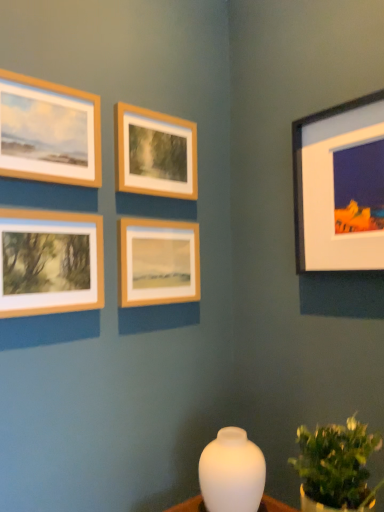
The height and width of the screenshot is (512, 384). What do you see at coordinates (50, 262) in the screenshot?
I see `matte wooden frame at lower left, the 4th picture frame in the right-to-left sequence` at bounding box center [50, 262].

Image resolution: width=384 pixels, height=512 pixels. What do you see at coordinates (154, 153) in the screenshot?
I see `wooden frame at upper center, which is counted as the 3th picture frame, starting from the right` at bounding box center [154, 153].

The width and height of the screenshot is (384, 512). In order to click on white glossy vase at center in this screenshot , I will do `click(232, 473)`.

What do you see at coordinates (337, 464) in the screenshot? The height and width of the screenshot is (512, 384). I see `green leafy plant at lower right` at bounding box center [337, 464].

At what (x,y) coordinates should I click in order to perform the action: click on matte wooden frame at lower left, the 4th picture frame in the right-to-left sequence. Please return your answer as a coordinate pair (x, y). Looking at the image, I should click on (50, 262).

Between green leafy plant at lower right and black matte frame at upper right, the first picture frame positioned from the right, which one has smaller size?

black matte frame at upper right, the first picture frame positioned from the right, is smaller.

From the picture: Considering the relative sizes of green leafy plant at lower right and black matte frame at upper right, marked as the 5th picture frame in a left-to-right arrangement, in the image provided, is green leafy plant at lower right taller than black matte frame at upper right, marked as the 5th picture frame in a left-to-right arrangement,?

No.

Does green leafy plant at lower right appear on the right side of black matte frame at upper right, the first picture frame positioned from the right?

In fact, green leafy plant at lower right is to the left of black matte frame at upper right, the first picture frame positioned from the right.

Can you tell me how much green leafy plant at lower right and black matte frame at upper right, marked as the 5th picture frame in a left-to-right arrangement, differ in facing direction?

The angle between the facing direction of green leafy plant at lower right and the facing direction of black matte frame at upper right, marked as the 5th picture frame in a left-to-right arrangement, is 2.45 degrees.

Looking at this image, can you confirm if wooden frame at upper center, which is counted as the 3th picture frame, starting from the right, is positioned to the right of matte wooden frame at lower left, acting as the 2th picture frame starting from the left?

Indeed, wooden frame at upper center, which is counted as the 3th picture frame, starting from the right, is positioned on the right side of matte wooden frame at lower left, acting as the 2th picture frame starting from the left.

Between point (175, 189) and point (27, 229), which one is positioned behind?

The point (175, 189) is farther.

Is wooden frame at upper center, which is counted as the third picture frame, starting from the left, not inside matte wooden frame at lower left, acting as the 2th picture frame starting from the left?

Yes, wooden frame at upper center, which is counted as the third picture frame, starting from the left, is outside of matte wooden frame at lower left, acting as the 2th picture frame starting from the left.

From the image's perspective, does wooden frame at upper center, which is counted as the third picture frame, starting from the left, appear higher than matte wooden frame at lower left, the 4th picture frame in the right-to-left sequence?

Indeed, from the image's perspective, wooden frame at upper center, which is counted as the third picture frame, starting from the left, is shown above matte wooden frame at lower left, the 4th picture frame in the right-to-left sequence.

From a real-world perspective, is white glossy vase at center physically above black matte frame at upper right, the first picture frame positioned from the right?

No, from a real-world perspective, white glossy vase at center is not on top of black matte frame at upper right, the first picture frame positioned from the right.

What's the angular difference between white glossy vase at center and black matte frame at upper right, the first picture frame positioned from the right,'s facing directions?

They differ by 1.03 degrees in their facing directions.

Is black matte frame at upper right, marked as the 5th picture frame in a left-to-right arrangement, inside white glossy vase at center?

No, black matte frame at upper right, marked as the 5th picture frame in a left-to-right arrangement, is not a part of white glossy vase at center.

From the image's perspective, which object appears higher, white glossy vase at center or black matte frame at upper right, the first picture frame positioned from the right?

black matte frame at upper right, the first picture frame positioned from the right, from the image's perspective.

Which is in front, point (30, 309) or point (136, 255)?

Positioned in front is point (30, 309).

Does matte wooden frame at lower left, the 4th picture frame in the right-to-left sequence, have a greater width compared to wooden frame at center, which ranks as the second picture frame in right-to-left order?

Correct, the width of matte wooden frame at lower left, the 4th picture frame in the right-to-left sequence, exceeds that of wooden frame at center, which ranks as the second picture frame in right-to-left order.

From a real-world perspective, which picture frame is the 1st one above the wooden frame at center, which ranks as the second picture frame in right-to-left order? Please provide its 2D coordinates.

[(50, 262)]

Is matte wooden frame at lower left, the 4th picture frame in the right-to-left sequence, oriented towards wooden frame at center, which ranks as the second picture frame in right-to-left order?

No, matte wooden frame at lower left, the 4th picture frame in the right-to-left sequence, is not turned towards wooden frame at center, which ranks as the second picture frame in right-to-left order.

Can you confirm if wooden frame at upper center, which is counted as the third picture frame, starting from the left, is thinner than wooden frame at upper left, the 1th picture frame positioned from the left?

Yes.

How many degrees apart are the facing directions of wooden frame at upper center, which is counted as the 3th picture frame, starting from the right, and wooden frame at upper left, the 1th picture frame positioned from the left?

There is a 0.000472-degree angle between the facing directions of wooden frame at upper center, which is counted as the 3th picture frame, starting from the right, and wooden frame at upper left, the 1th picture frame positioned from the left.

Looking at this image, is wooden frame at upper center, which is counted as the 3th picture frame, starting from the right, aimed at wooden frame at upper left, the 1th picture frame positioned from the left?

No, wooden frame at upper center, which is counted as the 3th picture frame, starting from the right, is not facing towards wooden frame at upper left, the 1th picture frame positioned from the left.

From the image's perspective, is wooden frame at upper center, which is counted as the 3th picture frame, starting from the right, located above wooden frame at upper left, the fifth picture frame when ordered from right to left?

No.

Is wooden frame at upper center, which is counted as the 3th picture frame, starting from the right, taller or shorter than black matte frame at upper right, the first picture frame positioned from the right?

Clearly, wooden frame at upper center, which is counted as the 3th picture frame, starting from the right, is shorter compared to black matte frame at upper right, the first picture frame positioned from the right.

Considering the points (173, 154) and (315, 170), which point is behind, point (173, 154) or point (315, 170)?

Positioned behind is point (173, 154).

This screenshot has width=384, height=512. I want to click on picture frame that is the 1st one when counting upward from the black matte frame at upper right, the first picture frame positioned from the right (from the image's perspective), so [154, 153].

Can you confirm if black matte frame at upper right, marked as the 5th picture frame in a left-to-right arrangement, is wider than white glossy vase at center?

In fact, black matte frame at upper right, marked as the 5th picture frame in a left-to-right arrangement, might be narrower than white glossy vase at center.

Is black matte frame at upper right, the first picture frame positioned from the right, spatially inside white glossy vase at center, or outside of it?

black matte frame at upper right, the first picture frame positioned from the right, lies outside white glossy vase at center.

Between black matte frame at upper right, the first picture frame positioned from the right, and white glossy vase at center, which one has larger size?

With larger size is black matte frame at upper right, the first picture frame positioned from the right.

Is the depth of black matte frame at upper right, marked as the 5th picture frame in a left-to-right arrangement, less than that of white glossy vase at center?

No, it is behind white glossy vase at center.

You are a GUI agent. You are given a task and a screenshot of the screen. Output one action in this format:
    pyautogui.click(x=<x>, y=<y>)
    Task: Click on the houseplant in front of the black matte frame at upper right, the first picture frame positioned from the right
    The width and height of the screenshot is (384, 512).
    Given the screenshot: What is the action you would take?
    pyautogui.click(x=337, y=464)

You are a GUI agent. You are given a task and a screenshot of the screen. Output one action in this format:
    pyautogui.click(x=<x>, y=<y>)
    Task: Click on the 2nd picture frame positioned below the wooden frame at upper center, which is counted as the third picture frame, starting from the left (from a real-world perspective)
    This screenshot has width=384, height=512.
    Given the screenshot: What is the action you would take?
    pyautogui.click(x=50, y=262)

Considering their positions, is wooden frame at upper left, the fifth picture frame when ordered from right to left, positioned closer to white glossy vase at center than matte wooden frame at lower left, acting as the 2th picture frame starting from the left?

matte wooden frame at lower left, acting as the 2th picture frame starting from the left, is closer to white glossy vase at center.

From the image, which object appears to be farther from wooden frame at upper center, which is counted as the third picture frame, starting from the left, white glossy vase at center or wooden frame at center, the fourth picture frame viewed from the left?

white glossy vase at center is positioned further to the anchor wooden frame at upper center, which is counted as the third picture frame, starting from the left.

When comparing their distances from white glossy vase at center, does wooden frame at upper left, the 1th picture frame positioned from the left, or green leafy plant at lower right seem further?

wooden frame at upper left, the 1th picture frame positioned from the left, lies further to white glossy vase at center than the other object.

Which object lies further to the anchor point green leafy plant at lower right, matte wooden frame at lower left, acting as the 2th picture frame starting from the left, or wooden frame at upper center, which is counted as the 3th picture frame, starting from the right?

wooden frame at upper center, which is counted as the 3th picture frame, starting from the right.

Looking at the image, which one is located closer to white glossy vase at center, matte wooden frame at lower left, the 4th picture frame in the right-to-left sequence, or black matte frame at upper right, the first picture frame positioned from the right?

matte wooden frame at lower left, the 4th picture frame in the right-to-left sequence, is positioned closer to the anchor white glossy vase at center.

Based on their spatial positions, is wooden frame at upper center, which is counted as the 3th picture frame, starting from the right, or wooden frame at center, the fourth picture frame viewed from the left, further from matte wooden frame at lower left, acting as the 2th picture frame starting from the left?

wooden frame at upper center, which is counted as the 3th picture frame, starting from the right.

From the image, which object appears to be farther from wooden frame at center, which ranks as the second picture frame in right-to-left order, matte wooden frame at lower left, the 4th picture frame in the right-to-left sequence, or black matte frame at upper right, marked as the 5th picture frame in a left-to-right arrangement?

black matte frame at upper right, marked as the 5th picture frame in a left-to-right arrangement, is further to wooden frame at center, which ranks as the second picture frame in right-to-left order.

Which object lies nearer to the anchor point wooden frame at center, the fourth picture frame viewed from the left, wooden frame at upper left, the fifth picture frame when ordered from right to left, or white glossy vase at center?

wooden frame at upper left, the fifth picture frame when ordered from right to left, is closer to wooden frame at center, the fourth picture frame viewed from the left.

I want to click on houseplant between wooden frame at upper left, the 1th picture frame positioned from the left, and white glossy vase at center, in the vertical direction, so click(337, 464).

This screenshot has width=384, height=512. Find the location of `vase between matte wooden frame at lower left, the 4th picture frame in the right-to-left sequence, and green leafy plant at lower right`. vase between matte wooden frame at lower left, the 4th picture frame in the right-to-left sequence, and green leafy plant at lower right is located at coordinates (232, 473).

The width and height of the screenshot is (384, 512). What are the coordinates of `picture frame between matte wooden frame at lower left, acting as the 2th picture frame starting from the left, and white glossy vase at center vertically` in the screenshot? It's located at (157, 262).

Image resolution: width=384 pixels, height=512 pixels. Identify the location of houseplant between black matte frame at upper right, marked as the 5th picture frame in a left-to-right arrangement, and white glossy vase at center, in the vertical direction. (337, 464).